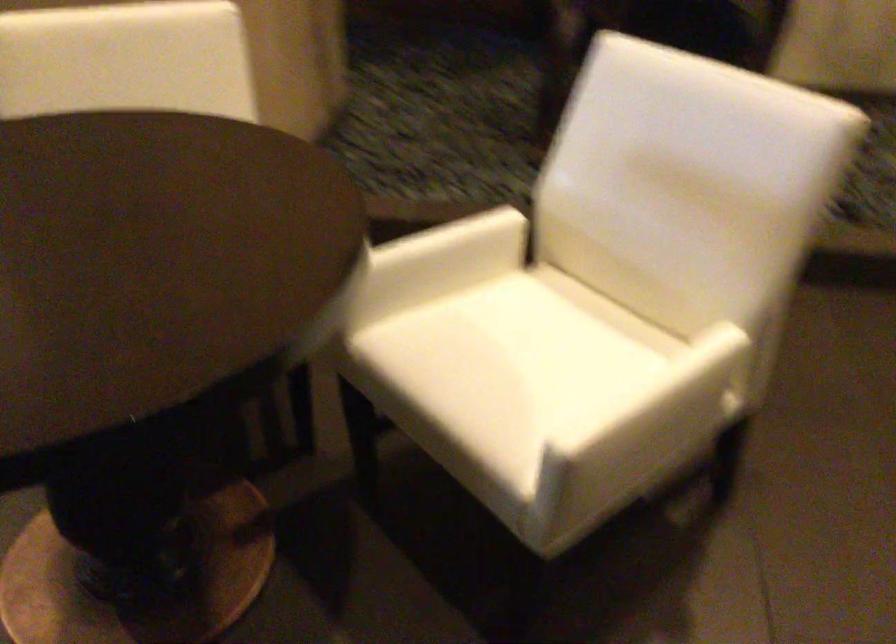
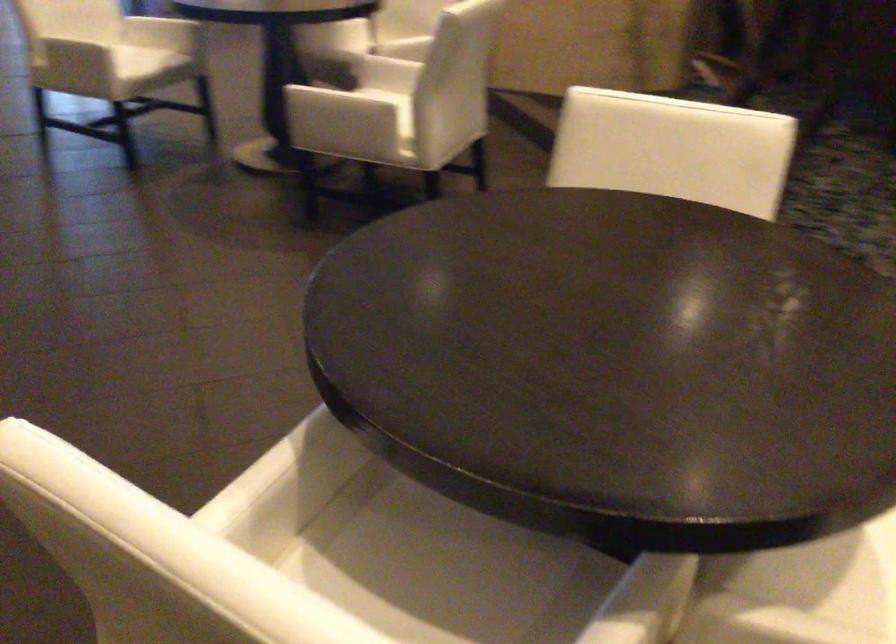
The point at (x=730, y=380) is marked in the first image. Where is the corresponding point in the second image?

(371, 109)